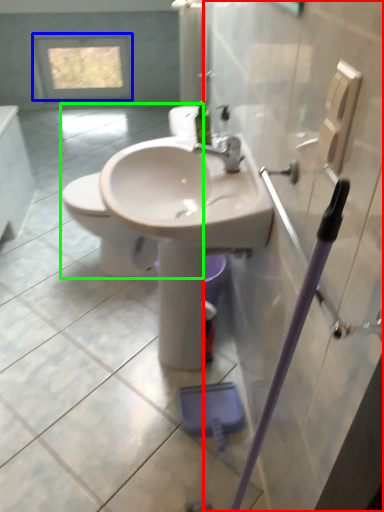
Question: Which is farther away from screen door (highlighted by a red box)? window (highlighted by a blue box) or toilet (highlighted by a green box)?

Choices:
 (A) window
 (B) toilet

Answer: (A)